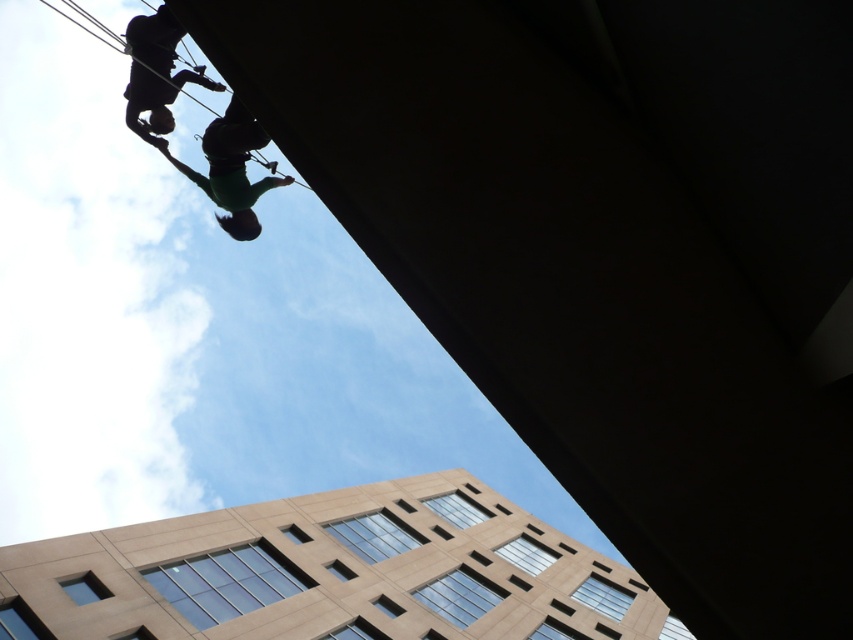
You are a safety inspector reviewing the image of the building rappelling operation. You need to ensure that the green fabric at upper center and the black matte climbing harness at upper left meet safety standards. Which object is larger in size and could potentially interfere with the rappeller during their descent?

The green fabric at upper center is larger in size than the black matte climbing harness at upper left, so it could potentially interfere with the rappeller during their descent.